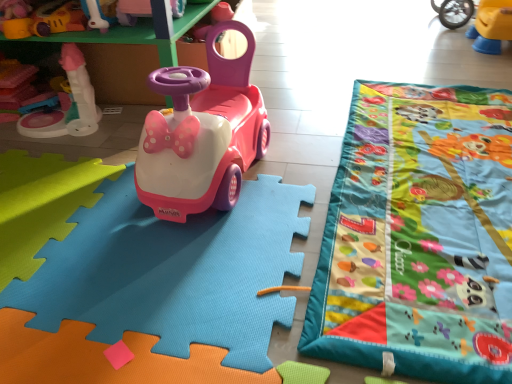
At what (x,y) coordinates should I click in order to perform the action: click on free space behind multicolored fabric play mat at right. Please return your answer as a coordinate pair (x, y). Image resolution: width=512 pixels, height=384 pixels. Looking at the image, I should click on (369, 72).